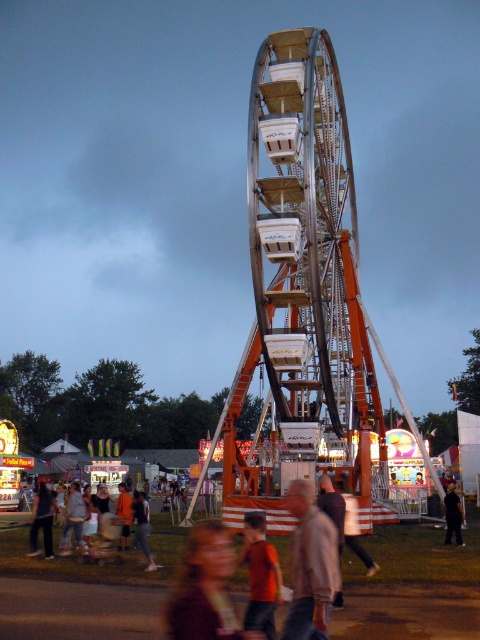
You are standing at the base of the Ferris wheel and notice two jackets nearby. The light brown jacket at center and the dark brown leather jacket at lower left. Which jacket is closer to you?

The light brown jacket at center is closer to you because it is in front of the dark brown leather jacket at lower left.

You are at the carnival and want to choose a jacket to wear over your clothes. You see a light brown jacket at center and a dark gray hoodie at center. Which one would you pick if you want the bigger option?

The light brown jacket at center is larger in size than the dark gray hoodie at center, so you should pick the light brown jacket at center for the bigger option.